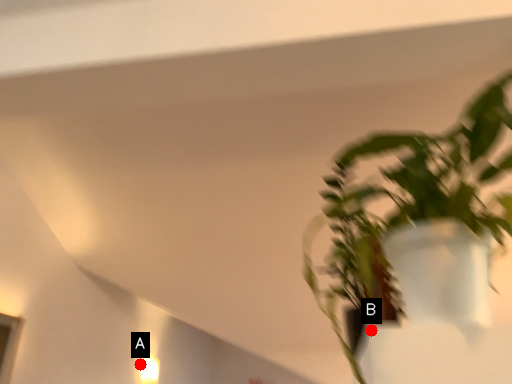
Question: Two points are circled on the image, labeled by A and B beside each circle. Which point appears closest to the camera in this image?

Choices:
 (A) A is closer
 (B) B is closer

Answer: (B)